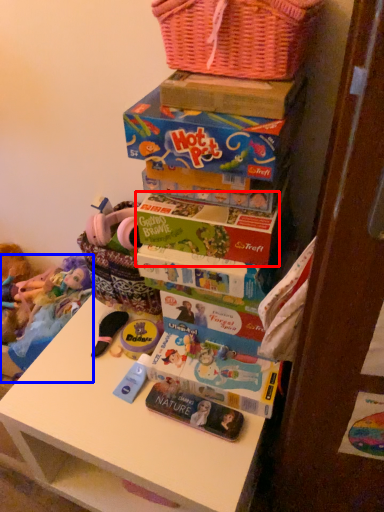
Question: Which object appears farthest to the camera in this image, book (highlighted by a red box) or toy (highlighted by a blue box)?

Choices:
 (A) book
 (B) toy

Answer: (B)